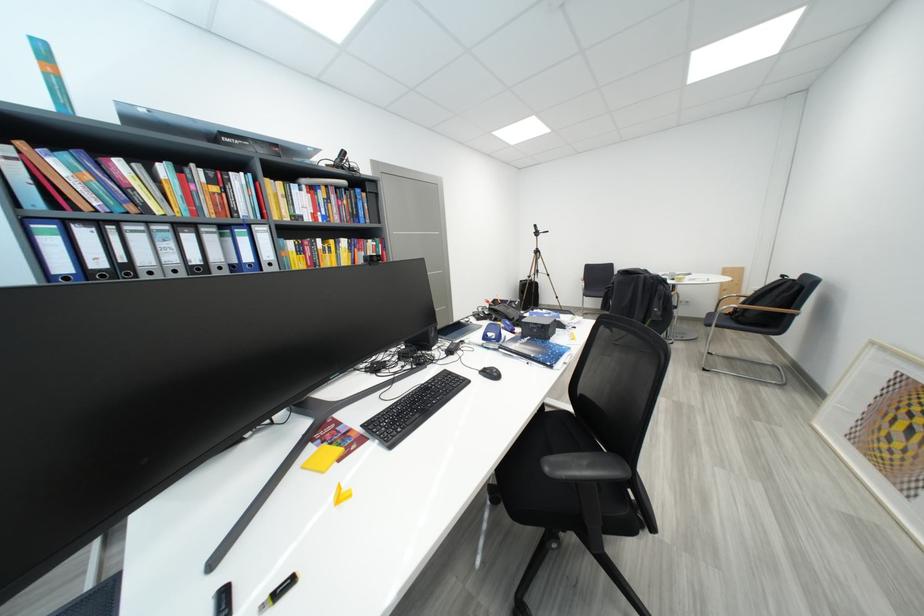
This screenshot has width=924, height=616. In order to click on black chair armrest in this screenshot , I will do `click(586, 467)`.